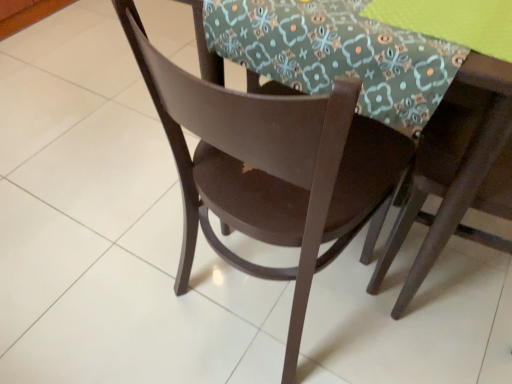
Find the location of a particular element. The height and width of the screenshot is (384, 512). free space that is in between matte brown table at center and matte brown chair at center, which is the 2th chair from right to left is located at coordinates (350, 354).